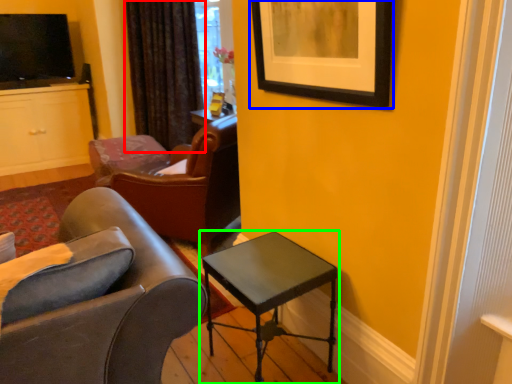
Question: Considering the real-world distances, which object is farthest from curtain (highlighted by a red box)? picture frame (highlighted by a blue box) or table (highlighted by a green box)?

Choices:
 (A) picture frame
 (B) table

Answer: (B)